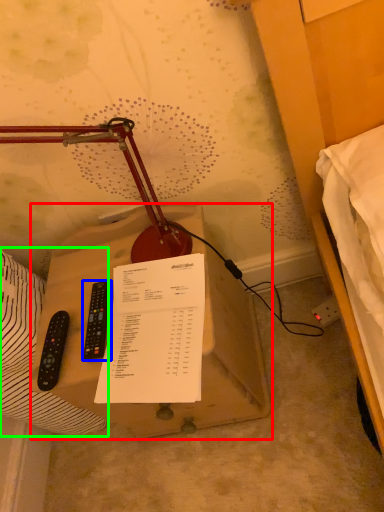
Question: Considering the real-world distances, which object is closest to table (highlighted by a red box)? remote control (highlighted by a blue box) or sheet (highlighted by a green box).

Choices:
 (A) remote control
 (B) sheet

Answer: (B)